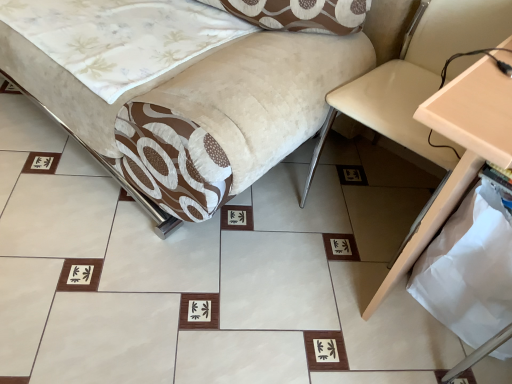
Where is `beige wood table at right`? The image size is (512, 384). beige wood table at right is located at coordinates (464, 152).

The height and width of the screenshot is (384, 512). Describe the element at coordinates (418, 77) in the screenshot. I see `beige leather swivel chair at right` at that location.

Image resolution: width=512 pixels, height=384 pixels. What do you see at coordinates (184, 87) in the screenshot?
I see `velvet beige sofa at center` at bounding box center [184, 87].

The image size is (512, 384). I want to click on beige wood table at right, so click(x=464, y=152).

Which is in front, point (464, 71) or point (423, 62)?

The point (464, 71) is more forward.

Considering the positions of objects beige wood table at right and beige leather swivel chair at right in the image provided, who is more to the right, beige wood table at right or beige leather swivel chair at right?

beige wood table at right.

Which object is closer to the camera taking this photo, beige wood table at right or beige leather swivel chair at right?

beige wood table at right is closer to the camera.

From the image's perspective, which is above, beige wood table at right or beige leather swivel chair at right?

beige leather swivel chair at right, from the image's perspective.

Which is nearer, (358, 90) or (504, 47)?

Clearly, point (358, 90) is more distant from the camera than point (504, 47).

Between beige leather swivel chair at right and beige wood table at right, which one is positioned behind?

beige leather swivel chair at right is further from the camera.

From the picture: Is beige leather swivel chair at right touching beige wood table at right?

beige leather swivel chair at right and beige wood table at right are not in contact.

From a real-world perspective, is beige leather swivel chair at right under beige wood table at right?

Correct, in the physical world, beige leather swivel chair at right is lower than beige wood table at right.

The width and height of the screenshot is (512, 384). In order to click on table on the right of velvet beige sofa at center in this screenshot , I will do `click(464, 152)`.

Is point (415, 115) closer or farther from the camera than point (279, 134)?

Point (415, 115) is positioned farther from the camera compared to point (279, 134).

How many degrees apart are the facing directions of beige wood table at right and velvet beige sofa at center?

They differ by 2.52 degrees in their facing directions.

Considering the points (478, 28) and (172, 29), which point is behind, point (478, 28) or point (172, 29)?

The point (172, 29) is farther.

The height and width of the screenshot is (384, 512). I want to click on furniture on the left of beige leather swivel chair at right, so (184, 87).

From the image's perspective, relative to velvet beige sofa at center, is beige leather swivel chair at right above or below?

beige leather swivel chair at right is situated lower than velvet beige sofa at center in the image.

Based on the photo, would you say velvet beige sofa at center is part of beige leather swivel chair at right's contents?

No, beige leather swivel chair at right does not contain velvet beige sofa at center.

Can you tell me how much velvet beige sofa at center and beige leather swivel chair at right differ in facing direction?

They differ by 0.87 degrees in their facing directions.

Can you confirm if velvet beige sofa at center is thinner than beige leather swivel chair at right?

No, velvet beige sofa at center is not thinner than beige leather swivel chair at right.

Image resolution: width=512 pixels, height=384 pixels. Find the location of `swivel chair below the velvet beige sofa at center (from a real-world perspective)`. swivel chair below the velvet beige sofa at center (from a real-world perspective) is located at coordinates (418, 77).

Which is more distant, [242,114] or [428,150]?

The point [428,150] is farther.

From the image's perspective, is velvet beige sofa at center over beige wood table at right?

Yes.

Looking at this image, is velvet beige sofa at center positioned far away from beige wood table at right?

velvet beige sofa at center is actually quite close to beige wood table at right.

Locate an element on the screen. furniture lying behind the beige wood table at right is located at coordinates (184, 87).

Is velvet beige sofa at center aimed at beige wood table at right?

No.

You are a GUI agent. You are given a task and a screenshot of the screen. Output one action in this format:
    pyautogui.click(x=<x>, y=<y>)
    Task: Click on the swivel chair on the left of beige wood table at right
    Image resolution: width=512 pixels, height=384 pixels.
    Given the screenshot: What is the action you would take?
    pyautogui.click(x=418, y=77)

Locate an element on the screen. swivel chair lying above the beige wood table at right (from the image's perspective) is located at coordinates (418, 77).

Which object lies nearer to the anchor point velvet beige sofa at center, beige wood table at right or beige leather swivel chair at right?

beige leather swivel chair at right is closer to velvet beige sofa at center.

Based on their spatial positions, is beige leather swivel chair at right or beige wood table at right closer to velvet beige sofa at center?

beige leather swivel chair at right is positioned closer to the anchor velvet beige sofa at center.

Looking at the image, which one is located closer to beige wood table at right, beige leather swivel chair at right or velvet beige sofa at center?

beige leather swivel chair at right is positioned closer to the anchor beige wood table at right.

Looking at this image, when comparing their distances from beige leather swivel chair at right, does beige wood table at right or velvet beige sofa at center seem closer?

Based on the image, beige wood table at right appears to be nearer to beige leather swivel chair at right.

Considering their positions, is velvet beige sofa at center positioned closer to beige wood table at right than beige leather swivel chair at right?

The object closer to beige wood table at right is beige leather swivel chair at right.

Estimate the real-world distances between objects in this image. Which object is further from beige leather swivel chair at right, velvet beige sofa at center or beige wood table at right?

Among the two, velvet beige sofa at center is located further to beige leather swivel chair at right.

This screenshot has height=384, width=512. Find the location of `swivel chair located between velvet beige sofa at center and beige wood table at right in the left-right direction`. swivel chair located between velvet beige sofa at center and beige wood table at right in the left-right direction is located at coordinates (418, 77).